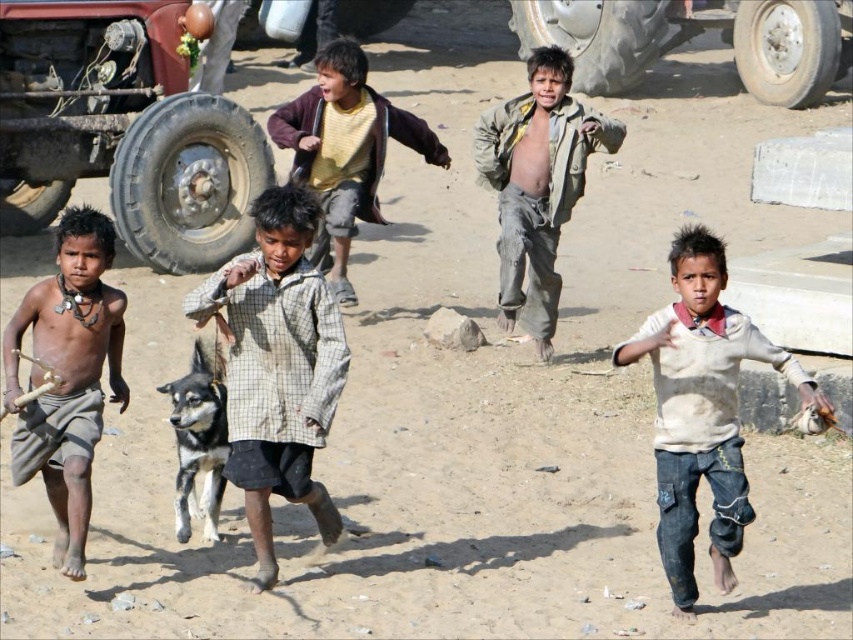
Between dirty gray pants at center and rubber tire at upper center, which one is positioned lower?

dirty gray pants at center is lower down.

Where is `dirty gray pants at center`? dirty gray pants at center is located at coordinates (537, 184).

Identify the location of dirty gray pants at center. Image resolution: width=853 pixels, height=640 pixels. (537, 184).

Does checkered fabric shirt at center have a greater width compared to yellow cotton shirt at center?

No.

Does checkered fabric shirt at center have a greater height compared to yellow cotton shirt at center?

No, checkered fabric shirt at center is not taller than yellow cotton shirt at center.

Which is behind, point (283, 307) or point (445, 164)?

Point (445, 164)

I want to click on checkered fabric shirt at center, so click(x=277, y=365).

In the scene shown: Can you confirm if rubber tire at upper center is positioned above gray rubber tire at upper right?

Indeed, rubber tire at upper center is positioned over gray rubber tire at upper right.

Who is more forward, (534, 19) or (741, 38)?

Point (741, 38) is in front.

Where is `rubber tire at upper center`? The image size is (853, 640). rubber tire at upper center is located at coordinates (595, 36).

What are the coordinates of `rubber tire at upper center` in the screenshot? It's located at (595, 36).